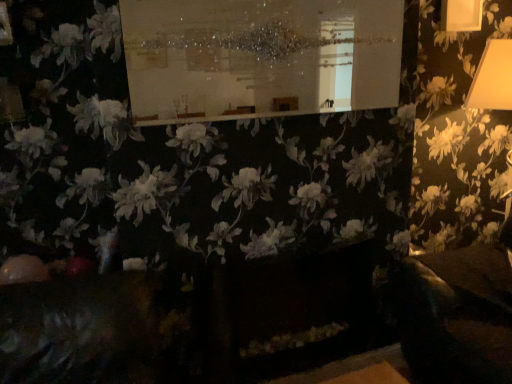
What do you see at coordinates (259, 57) in the screenshot? I see `white glossy board at upper center` at bounding box center [259, 57].

Where is `white glossy board at upper center`? Image resolution: width=512 pixels, height=384 pixels. white glossy board at upper center is located at coordinates (259, 57).

Describe the element at coordinates (457, 136) in the screenshot. I see `yellow matte lampshade at right` at that location.

What is the approximate width of yellow matte lampshade at right?

21.16 inches.

Where is `yellow matte lampshade at right`? yellow matte lampshade at right is located at coordinates (457, 136).

The height and width of the screenshot is (384, 512). Identify the location of white glossy board at upper center. (259, 57).

Which object is positioned more to the right, white glossy board at upper center or yellow matte lampshade at right?

Positioned to the right is yellow matte lampshade at right.

Considering their positions, is white glossy board at upper center located in front of or behind yellow matte lampshade at right?

white glossy board at upper center is positioned closer to the viewer than yellow matte lampshade at right.

Is point (155, 85) positioned in front of point (474, 190)?

Yes, point (155, 85) is in front of point (474, 190).

From the image's perspective, which is below, white glossy board at upper center or yellow matte lampshade at right?

yellow matte lampshade at right appears lower in the image.

From a real-world perspective, is white glossy board at upper center located higher than yellow matte lampshade at right?

Yes, from a real-world perspective, white glossy board at upper center is above yellow matte lampshade at right.

Is white glossy board at upper center wider or thinner than yellow matte lampshade at right?

white glossy board at upper center is thinner than yellow matte lampshade at right.

Is white glossy board at upper center taller or shorter than yellow matte lampshade at right?

Considering their sizes, white glossy board at upper center has less height than yellow matte lampshade at right.

Does white glossy board at upper center have a larger size compared to yellow matte lampshade at right?

Actually, white glossy board at upper center might be smaller than yellow matte lampshade at right.

Choose the correct answer: Is white glossy board at upper center inside yellow matte lampshade at right or outside it?

The correct answer is: outside.

Is white glossy board at upper center touching yellow matte lampshade at right?

There is a gap between white glossy board at upper center and yellow matte lampshade at right.

Is yellow matte lampshade at right at the back of white glossy board at upper center?

No, white glossy board at upper center's orientation is not away from yellow matte lampshade at right.

What's the angular difference between white glossy board at upper center and yellow matte lampshade at right's facing directions?

4.12 degrees separate the facing orientations of white glossy board at upper center and yellow matte lampshade at right.

Identify the location of bulletin board on the left of yellow matte lampshade at right. (259, 57).

Visually, is yellow matte lampshade at right positioned to the left or to the right of white glossy board at upper center?

yellow matte lampshade at right is positioned on white glossy board at upper center's right side.

Is the position of yellow matte lampshade at right more distant than that of white glossy board at upper center?

Yes, it is behind white glossy board at upper center.

Does point (456, 217) appear closer or farther from the camera than point (161, 83)?

Clearly, point (456, 217) is more distant from the camera than point (161, 83).

From the image's perspective, who appears lower, yellow matte lampshade at right or white glossy board at upper center?

yellow matte lampshade at right appears lower in the image.

From a real-world perspective, is yellow matte lampshade at right positioned under white glossy board at upper center based on gravity?

Yes, from a real-world perspective, yellow matte lampshade at right is under white glossy board at upper center.

Is yellow matte lampshade at right wider than white glossy board at upper center?

Yes.

Which of these two, yellow matte lampshade at right or white glossy board at upper center, stands taller?

With more height is yellow matte lampshade at right.

Between yellow matte lampshade at right and white glossy board at upper center, which one has smaller size?

With smaller size is white glossy board at upper center.

Is yellow matte lampshade at right positioned beyond the bounds of white glossy board at upper center?

yellow matte lampshade at right is positioned outside white glossy board at upper center.

Is the surface of yellow matte lampshade at right in direct contact with white glossy board at upper center?

No, yellow matte lampshade at right is not beside white glossy board at upper center.

Is yellow matte lampshade at right facing towards white glossy board at upper center?

No, yellow matte lampshade at right is not turned towards white glossy board at upper center.

Measure the distance from yellow matte lampshade at right to white glossy board at upper center.

The distance of yellow matte lampshade at right from white glossy board at upper center is 3.53 feet.

At what (x,y) coordinates should I click in order to perform the action: click on flower below the white glossy board at upper center (from the image's perspective). Please return your answer as a coordinate pair (x, y). Image resolution: width=512 pixels, height=384 pixels. Looking at the image, I should click on (457, 136).

Find the location of a particular element. This screenshot has height=384, width=512. bulletin board located in front of the yellow matte lampshade at right is located at coordinates (259, 57).

What are the coordinates of `bulletin board to the left of yellow matte lampshade at right` in the screenshot? It's located at (259, 57).